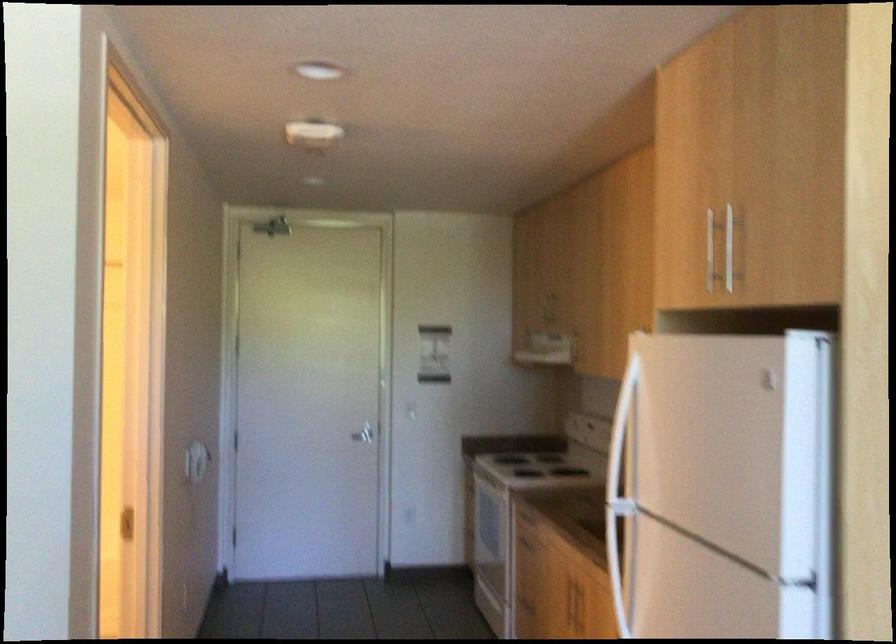
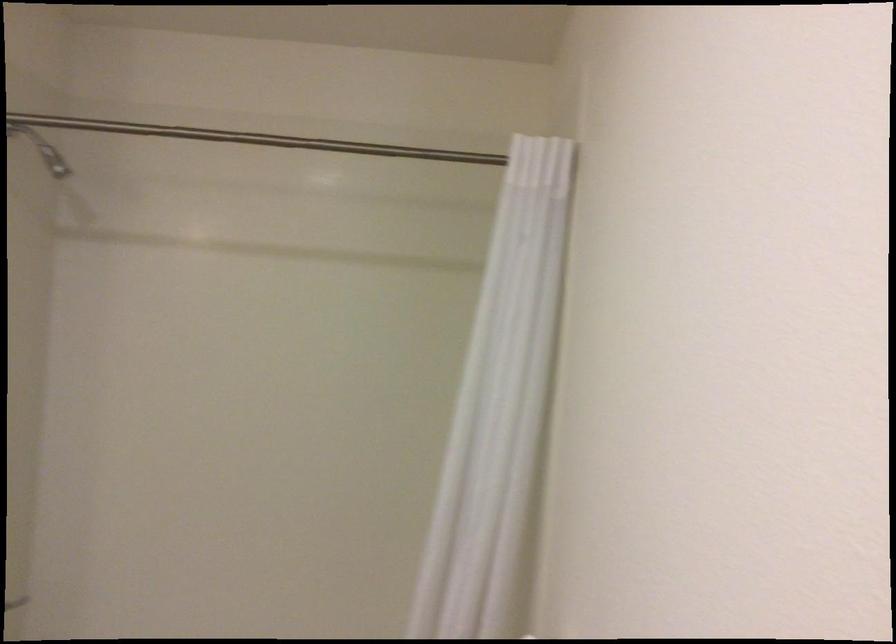
The images are taken continuously from a first-person perspective. In which direction are you moving?

The movement direction of the cameraman is left, forward.